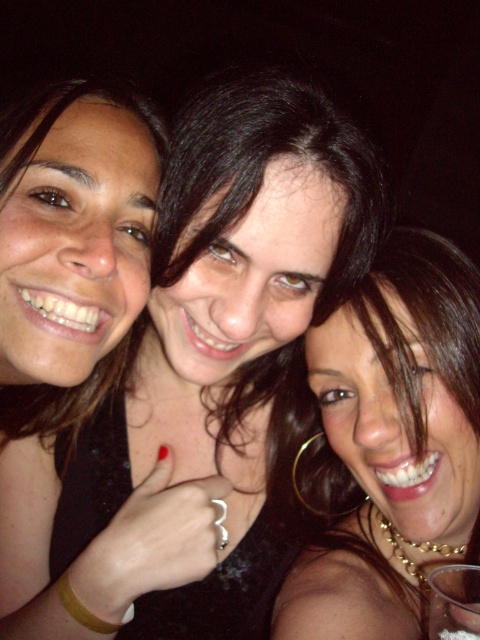
Question: Does gold hoop earring at upper center appear on the right side of clear plastic cup at lower right?

Choices:
 (A) no
 (B) yes

Answer: (B)

Question: Estimate the real-world distances between objects in this image. Which object is closer to the transparent glass at lower right?

Choices:
 (A) clear plastic cup at lower right
 (B) gold hoop earring at upper center

Answer: (A)

Question: Where is transparent glass at lower right located in relation to clear plastic cup at lower right in the image?

Choices:
 (A) right
 (B) left

Answer: (A)

Question: Which object appears closest to the camera in this image?

Choices:
 (A) clear plastic cup at lower right
 (B) gold hoop earring at upper center

Answer: (A)

Question: Is transparent glass at lower right above clear plastic cup at lower right?

Choices:
 (A) no
 (B) yes

Answer: (B)

Question: Which is nearer to the gold hoop earring at upper center?

Choices:
 (A) clear plastic cup at lower right
 (B) transparent glass at lower right

Answer: (B)